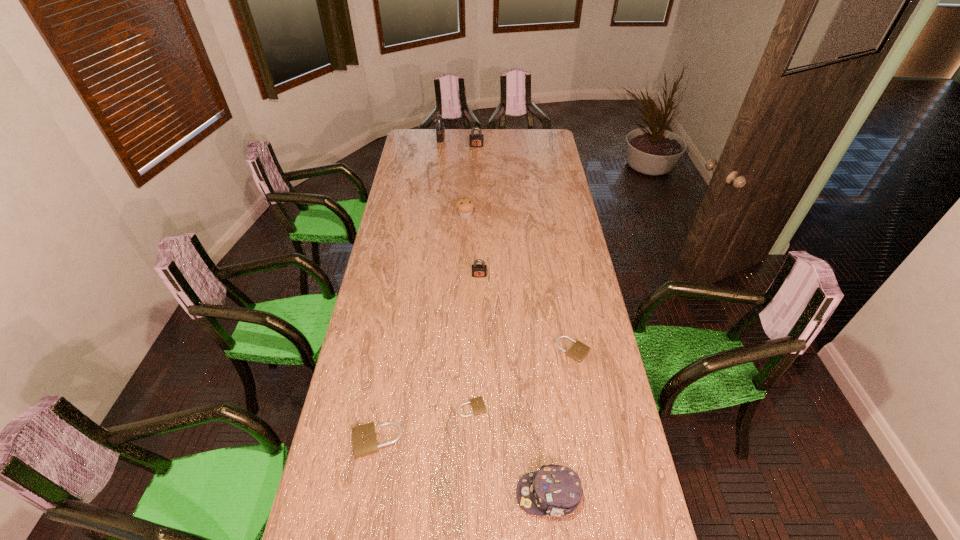
The image size is (960, 540). In order to click on vacant region that satisfies the following two spatial constraints: 1. on the front of the tallest padlock near the keyhole; 2. on the right side of the second beige padlock from left to right in this screenshot , I will do `click(406, 408)`.

Locate an element on the screen. Image resolution: width=960 pixels, height=540 pixels. vacant space that satisfies the following two spatial constraints: 1. on the front of the fourth farthest object near the keyhole; 2. on the right side of the rightmost beige padlock is located at coordinates [x=479, y=350].